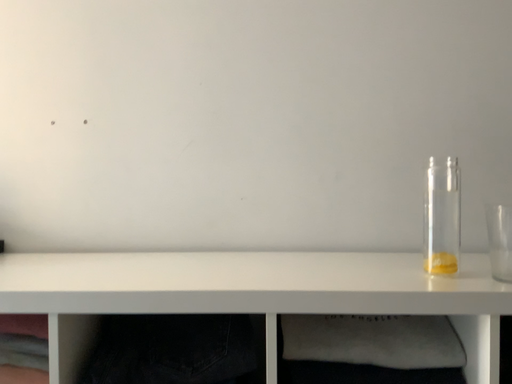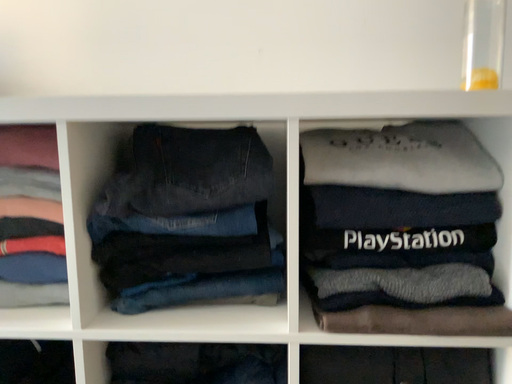
Question: Which way did the camera rotate in the video?

Choices:
 (A) rotated upward
 (B) rotated downward

Answer: (B)